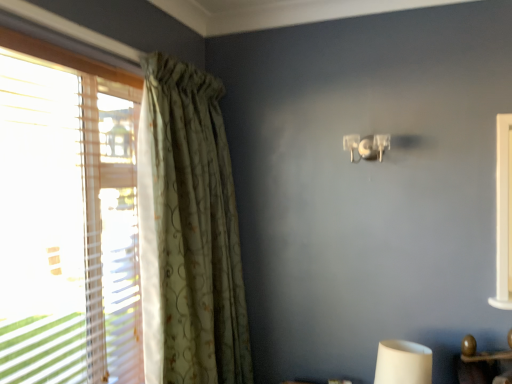
Question: Is green floral fabric curtain at left taller than clear plastic lamp at upper center?

Choices:
 (A) no
 (B) yes

Answer: (B)

Question: Is the surface of green floral fabric curtain at left in direct contact with clear plastic lamp at upper center?

Choices:
 (A) no
 (B) yes

Answer: (A)

Question: From a real-world perspective, is green floral fabric curtain at left located beneath clear plastic lamp at upper center?

Choices:
 (A) yes
 (B) no

Answer: (A)

Question: Is green floral fabric curtain at left aimed at clear plastic lamp at upper center?

Choices:
 (A) yes
 (B) no

Answer: (A)

Question: Does green floral fabric curtain at left have a smaller size compared to clear plastic lamp at upper center?

Choices:
 (A) yes
 (B) no

Answer: (B)

Question: Is green floral fabric curtain at left to the left of clear plastic lamp at upper center from the viewer's perspective?

Choices:
 (A) yes
 (B) no

Answer: (A)

Question: From a real-world perspective, does clear plastic lamp at upper center sit lower than green floral fabric curtain at left?

Choices:
 (A) yes
 (B) no

Answer: (B)

Question: Is clear plastic lamp at upper center to the right of green floral fabric curtain at left from the viewer's perspective?

Choices:
 (A) no
 (B) yes

Answer: (B)

Question: Is clear plastic lamp at upper center not near green floral fabric curtain at left?

Choices:
 (A) no
 (B) yes

Answer: (A)

Question: From a real-world perspective, is clear plastic lamp at upper center located higher than green floral fabric curtain at left?

Choices:
 (A) yes
 (B) no

Answer: (A)

Question: Considering the relative sizes of clear plastic lamp at upper center and green floral fabric curtain at left in the image provided, is clear plastic lamp at upper center smaller than green floral fabric curtain at left?

Choices:
 (A) yes
 (B) no

Answer: (A)

Question: Can you confirm if clear plastic lamp at upper center is bigger than green floral fabric curtain at left?

Choices:
 (A) no
 (B) yes

Answer: (A)

Question: From a real-world perspective, is green floral fabric curtain at left physically located above or below clear plastic lamp at upper center?

Choices:
 (A) below
 (B) above

Answer: (A)